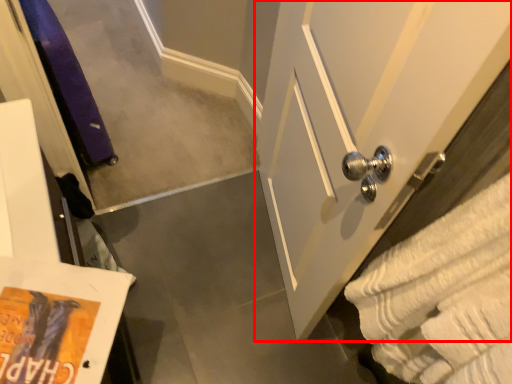
Question: From the image's perspective, where is door (annotated by the red box) located in relation to bath towel in the image?

Choices:
 (A) below
 (B) above

Answer: (B)